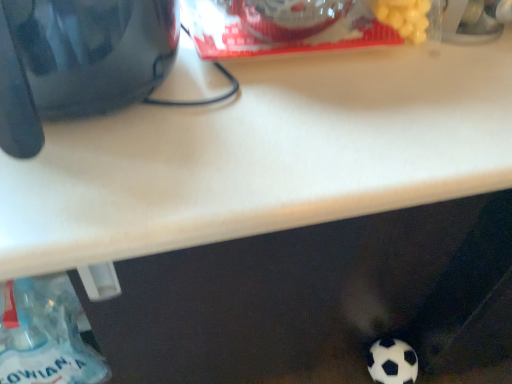
At what (x,y) coordinates should I click in order to perform the action: click on glossy black kettle at upper left. Please return your answer as a coordinate pair (x, y). The image size is (512, 384). Looking at the image, I should click on (77, 60).

Locate an element on the screen. The image size is (512, 384). translucent plastic bottle at lower left is located at coordinates (45, 335).

Which of these two, translucent plastic bottle at lower left or white matte football at lower right, is thinner?

white matte football at lower right.

From a real-world perspective, does translucent plastic bottle at lower left sit lower than white matte football at lower right?

No, from a real-world perspective, translucent plastic bottle at lower left is not below white matte football at lower right.

Image resolution: width=512 pixels, height=384 pixels. In order to click on bottle lying in front of the white matte football at lower right in this screenshot , I will do `click(45, 335)`.

Which is more to the right, translucent plastic bottle at lower left or white matte football at lower right?

Positioned to the right is white matte football at lower right.

Considering the relative sizes of white matte football at lower right and glossy black kettle at upper left in the image provided, is white matte football at lower right smaller than glossy black kettle at upper left?

Indeed, white matte football at lower right has a smaller size compared to glossy black kettle at upper left.

Is white matte football at lower right positioned far away from glossy black kettle at upper left?

white matte football at lower right is actually quite close to glossy black kettle at upper left.

Which of these two, white matte football at lower right or glossy black kettle at upper left, stands taller?

glossy black kettle at upper left.

Considering the relative positions of white matte football at lower right and glossy black kettle at upper left in the image provided, is white matte football at lower right to the left of glossy black kettle at upper left from the viewer's perspective?

No.

Is glossy black kettle at upper left not near white matte football at lower right?

glossy black kettle at upper left is actually quite close to white matte football at lower right.

Considering the sizes of objects glossy black kettle at upper left and white matte football at lower right in the image provided, who is bigger, glossy black kettle at upper left or white matte football at lower right?

Bigger between the two is glossy black kettle at upper left.

Which point is more forward, [5,126] or [393,372]?

The point [5,126] is more forward.

Which of these two, glossy black kettle at upper left or white matte football at lower right, is thinner?

white matte football at lower right.

From a real-world perspective, who is located lower, translucent plastic bottle at lower left or glossy black kettle at upper left?

translucent plastic bottle at lower left.

In the image, is translucent plastic bottle at lower left positioned in front of or behind glossy black kettle at upper left?

translucent plastic bottle at lower left is positioned farther from the viewer than glossy black kettle at upper left.

Could you tell me if translucent plastic bottle at lower left is facing glossy black kettle at upper left?

No, translucent plastic bottle at lower left is not turned towards glossy black kettle at upper left.

From a real-world perspective, is glossy black kettle at upper left physically above translucent plastic bottle at lower left?

Yes.

Considering the relative positions of glossy black kettle at upper left and translucent plastic bottle at lower left in the image provided, is glossy black kettle at upper left to the left or to the right of translucent plastic bottle at lower left?

In the image, glossy black kettle at upper left appears on the right side of translucent plastic bottle at lower left.

Does glossy black kettle at upper left contain translucent plastic bottle at lower left?

No, translucent plastic bottle at lower left is located outside of glossy black kettle at upper left.

Could you tell me if glossy black kettle at upper left is turned towards translucent plastic bottle at lower left?

No, glossy black kettle at upper left does not turn towards translucent plastic bottle at lower left.

Who is taller, white matte football at lower right or translucent plastic bottle at lower left?

translucent plastic bottle at lower left is taller.

How different are the orientations of white matte football at lower right and translucent plastic bottle at lower left in degrees?

0.167 degrees.

Does white matte football at lower right come behind translucent plastic bottle at lower left?

Yes.

This screenshot has width=512, height=384. In order to click on football below the translucent plastic bottle at lower left (from the image's perspective) in this screenshot , I will do `click(392, 362)`.

Locate an element on the screen. This screenshot has height=384, width=512. appliance on the left of the white matte football at lower right is located at coordinates (77, 60).

When comparing their distances from translucent plastic bottle at lower left, does glossy black kettle at upper left or white matte football at lower right seem further?

white matte football at lower right is further to translucent plastic bottle at lower left.

When comparing their distances from glossy black kettle at upper left, does translucent plastic bottle at lower left or white matte football at lower right seem closer?

translucent plastic bottle at lower left.

From the image, which object appears to be nearer to white matte football at lower right, glossy black kettle at upper left or translucent plastic bottle at lower left?

translucent plastic bottle at lower left is closer to white matte football at lower right.

Based on their spatial positions, is translucent plastic bottle at lower left or glossy black kettle at upper left closer to white matte football at lower right?

Based on the image, translucent plastic bottle at lower left appears to be nearer to white matte football at lower right.

When comparing their distances from glossy black kettle at upper left, does white matte football at lower right or translucent plastic bottle at lower left seem further?

Among the two, white matte football at lower right is located further to glossy black kettle at upper left.

Estimate the real-world distances between objects in this image. Which object is further from translucent plastic bottle at lower left, white matte football at lower right or glossy black kettle at upper left?

white matte football at lower right.

Locate an element on the screen. The image size is (512, 384). appliance located between translucent plastic bottle at lower left and white matte football at lower right in the left-right direction is located at coordinates (77, 60).